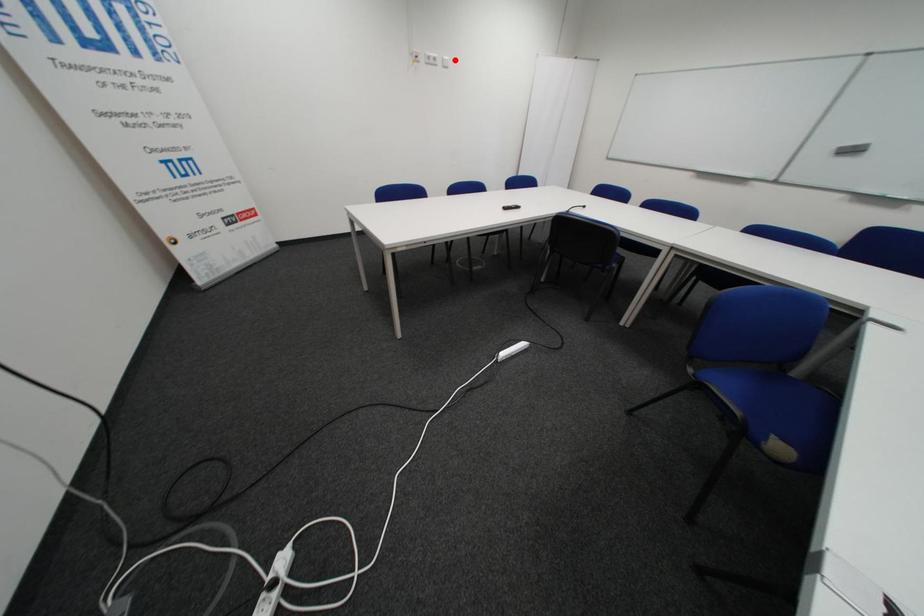
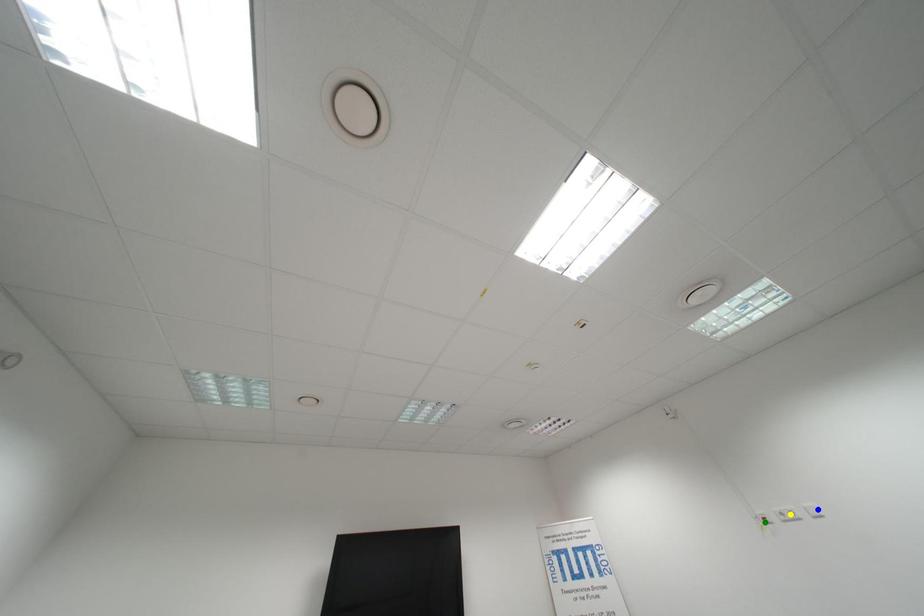
Question: I am providing you with two images of the same scene from different viewpoints. A red point is marked on the first image. You are given multiple points on the second image. Which point in image 2 is actually the same real-world point as the red point in image 1?

Choices:
 (A) yellow point
 (B) blue point
 (C) green point

Answer: (B)